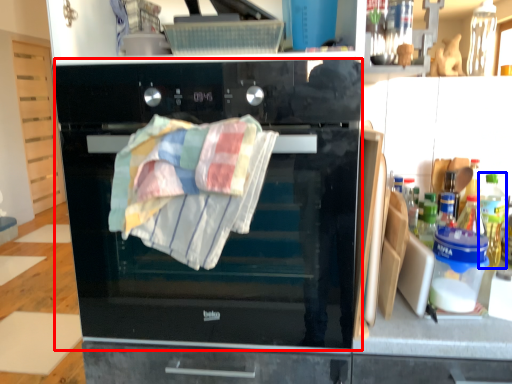
Question: Among these objects, which one is nearest to the camera, oven (highlighted by a red box) or bottle (highlighted by a blue box)?

Choices:
 (A) oven
 (B) bottle

Answer: (A)